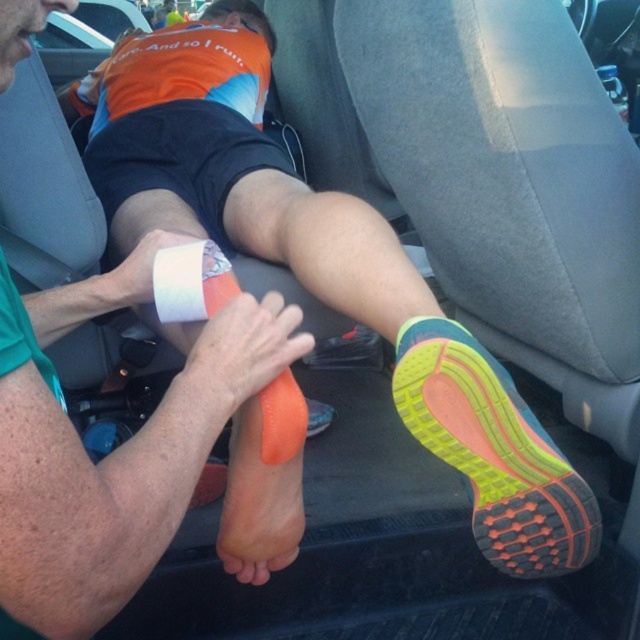
Is yellow rubber shoe at lower center further to the viewer compared to orange foam at center?

No, it is not.

Between point (467, 468) and point (227, 529), which one is positioned behind?

The point (227, 529) is more distant.

This screenshot has height=640, width=640. I want to click on yellow rubber shoe at lower center, so click(493, 451).

Is orange foam at center closer to camera compared to white adhesive tape at center?

Yes, orange foam at center is closer to the viewer.

Is orange foam at center above white adhesive tape at center?

No, orange foam at center is not above white adhesive tape at center.

At what (x,y) coordinates should I click in order to perform the action: click on orange foam at center. Please return your answer as a coordinate pair (x, y). The height and width of the screenshot is (640, 640). Looking at the image, I should click on (264, 483).

Locate an element on the screen. The image size is (640, 640). orange foam at center is located at coordinates (264, 483).

Locate an element on the screen. white adhesive tape at lower center is located at coordinates (192, 282).

Can you confirm if white adhesive tape at lower center is smaller than white adhesive tape at center?

Incorrect, white adhesive tape at lower center is not smaller in size than white adhesive tape at center.

The height and width of the screenshot is (640, 640). What do you see at coordinates (192, 282) in the screenshot?
I see `white adhesive tape at lower center` at bounding box center [192, 282].

Find the location of a particular element. white adhesive tape at lower center is located at coordinates (192, 282).